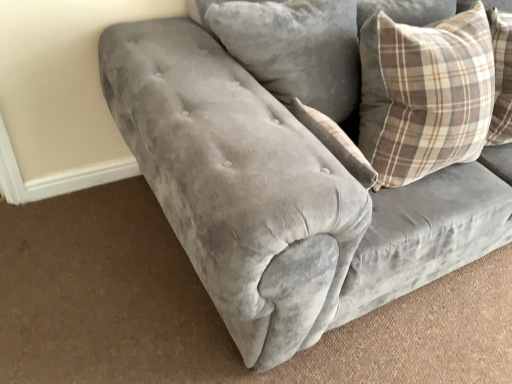
Image resolution: width=512 pixels, height=384 pixels. What do you see at coordinates (425, 94) in the screenshot?
I see `plaid fabric pillow at upper right, which appears as the second pillow when viewed from the left` at bounding box center [425, 94].

Measure the distance between plaid fabric pillow at upper right, which appears as the second pillow when viewed from the left, and camera.

They are 1.04 meters apart.

In order to click on plaid fabric pillow at upper right, which appears as the second pillow when viewed from the left in this screenshot , I will do `click(425, 94)`.

Locate an element on the screen. plaid fabric pillow at upper right, arranged as the 2th pillow when viewed from the right is located at coordinates pos(295,49).

The width and height of the screenshot is (512, 384). Describe the element at coordinates (295, 49) in the screenshot. I see `plaid fabric pillow at upper right, placed as the first pillow when sorted from left to right` at that location.

This screenshot has width=512, height=384. Find the location of `plaid fabric pillow at upper right, the 1th pillow from the right`. plaid fabric pillow at upper right, the 1th pillow from the right is located at coordinates (425, 94).

In the scene shown: Can you confirm if plaid fabric pillow at upper right, which appears as the second pillow when viewed from the left, is positioned to the right of plaid fabric pillow at upper right, placed as the first pillow when sorted from left to right?

Indeed, plaid fabric pillow at upper right, which appears as the second pillow when viewed from the left, is positioned on the right side of plaid fabric pillow at upper right, placed as the first pillow when sorted from left to right.

Is plaid fabric pillow at upper right, which appears as the second pillow when viewed from the left, in front of or behind plaid fabric pillow at upper right, arranged as the 2th pillow when viewed from the right, in the image?

In the image, plaid fabric pillow at upper right, which appears as the second pillow when viewed from the left, appears in front of plaid fabric pillow at upper right, arranged as the 2th pillow when viewed from the right.

Does point (389, 169) come farther from viewer compared to point (266, 32)?

Yes, it is.

From the image's perspective, does plaid fabric pillow at upper right, the 1th pillow from the right, appear lower than plaid fabric pillow at upper right, arranged as the 2th pillow when viewed from the right?

Yes, from the image's perspective, plaid fabric pillow at upper right, the 1th pillow from the right, is beneath plaid fabric pillow at upper right, arranged as the 2th pillow when viewed from the right.

From a real-world perspective, which is physically above, plaid fabric pillow at upper right, which appears as the second pillow when viewed from the left, or plaid fabric pillow at upper right, placed as the first pillow when sorted from left to right?

In real-world perspective, plaid fabric pillow at upper right, placed as the first pillow when sorted from left to right, is above.

Considering the relative sizes of plaid fabric pillow at upper right, the 1th pillow from the right, and plaid fabric pillow at upper right, arranged as the 2th pillow when viewed from the right, in the image provided, is plaid fabric pillow at upper right, the 1th pillow from the right, thinner than plaid fabric pillow at upper right, arranged as the 2th pillow when viewed from the right,?

Correct, the width of plaid fabric pillow at upper right, the 1th pillow from the right, is less than that of plaid fabric pillow at upper right, arranged as the 2th pillow when viewed from the right.

Considering the sizes of plaid fabric pillow at upper right, which appears as the second pillow when viewed from the left, and plaid fabric pillow at upper right, arranged as the 2th pillow when viewed from the right, in the image, is plaid fabric pillow at upper right, which appears as the second pillow when viewed from the left, taller or shorter than plaid fabric pillow at upper right, arranged as the 2th pillow when viewed from the right,?

In the image, plaid fabric pillow at upper right, which appears as the second pillow when viewed from the left, appears to be shorter than plaid fabric pillow at upper right, arranged as the 2th pillow when viewed from the right.

Who is bigger, plaid fabric pillow at upper right, the 1th pillow from the right, or plaid fabric pillow at upper right, arranged as the 2th pillow when viewed from the right?

plaid fabric pillow at upper right, arranged as the 2th pillow when viewed from the right.

Do you think plaid fabric pillow at upper right, which appears as the second pillow when viewed from the left, is within plaid fabric pillow at upper right, arranged as the 2th pillow when viewed from the right, or outside of it?

plaid fabric pillow at upper right, which appears as the second pillow when viewed from the left, is not enclosed by plaid fabric pillow at upper right, arranged as the 2th pillow when viewed from the right.

Consider the image. Would you say plaid fabric pillow at upper right, which appears as the second pillow when viewed from the left, is a long distance from plaid fabric pillow at upper right, arranged as the 2th pillow when viewed from the right?

No, plaid fabric pillow at upper right, which appears as the second pillow when viewed from the left, is in close proximity to plaid fabric pillow at upper right, arranged as the 2th pillow when viewed from the right.

Is plaid fabric pillow at upper right, which appears as the second pillow when viewed from the left, looking in the opposite direction of plaid fabric pillow at upper right, placed as the first pillow when sorted from left to right?

plaid fabric pillow at upper right, which appears as the second pillow when viewed from the left, is not turned away from plaid fabric pillow at upper right, placed as the first pillow when sorted from left to right.

Where is `pillow that is above the plaid fabric pillow at upper right, the 1th pillow from the right (from the image's perspective)`? The image size is (512, 384). pillow that is above the plaid fabric pillow at upper right, the 1th pillow from the right (from the image's perspective) is located at coordinates (295, 49).

Would you say plaid fabric pillow at upper right, arranged as the 2th pillow when viewed from the right, is to the left or to the right of plaid fabric pillow at upper right, which appears as the second pillow when viewed from the left, in the picture?

Based on their positions, plaid fabric pillow at upper right, arranged as the 2th pillow when viewed from the right, is located to the left of plaid fabric pillow at upper right, which appears as the second pillow when viewed from the left.

In the image, is plaid fabric pillow at upper right, placed as the first pillow when sorted from left to right, positioned in front of or behind plaid fabric pillow at upper right, which appears as the second pillow when viewed from the left?

plaid fabric pillow at upper right, placed as the first pillow when sorted from left to right, is positioned farther from the viewer than plaid fabric pillow at upper right, which appears as the second pillow when viewed from the left.

Is point (321, 21) closer or farther from the camera than point (407, 60)?

Point (321, 21) appears to be farther away from the viewer than point (407, 60).

From the image's perspective, which one is positioned higher, plaid fabric pillow at upper right, placed as the first pillow when sorted from left to right, or plaid fabric pillow at upper right, the 1th pillow from the right?

plaid fabric pillow at upper right, placed as the first pillow when sorted from left to right, is shown above in the image.

From a real-world perspective, is plaid fabric pillow at upper right, arranged as the 2th pillow when viewed from the right, physically below plaid fabric pillow at upper right, which appears as the second pillow when viewed from the left?

No.

Which of these two, plaid fabric pillow at upper right, arranged as the 2th pillow when viewed from the right, or plaid fabric pillow at upper right, which appears as the second pillow when viewed from the left, is thinner?

plaid fabric pillow at upper right, which appears as the second pillow when viewed from the left, is thinner.

Which of these two, plaid fabric pillow at upper right, placed as the first pillow when sorted from left to right, or plaid fabric pillow at upper right, which appears as the second pillow when viewed from the left, stands shorter?

plaid fabric pillow at upper right, which appears as the second pillow when viewed from the left, is shorter.

Is plaid fabric pillow at upper right, placed as the first pillow when sorted from left to right, smaller than plaid fabric pillow at upper right, which appears as the second pillow when viewed from the left?

Incorrect, plaid fabric pillow at upper right, placed as the first pillow when sorted from left to right, is not smaller in size than plaid fabric pillow at upper right, which appears as the second pillow when viewed from the left.

Could plaid fabric pillow at upper right, which appears as the second pillow when viewed from the left, be considered to be inside plaid fabric pillow at upper right, placed as the first pillow when sorted from left to right?

Actually, plaid fabric pillow at upper right, which appears as the second pillow when viewed from the left, is outside plaid fabric pillow at upper right, placed as the first pillow when sorted from left to right.

Would you say plaid fabric pillow at upper right, placed as the first pillow when sorted from left to right, is a long distance from plaid fabric pillow at upper right, which appears as the second pillow when viewed from the left?

No, plaid fabric pillow at upper right, placed as the first pillow when sorted from left to right, is not far away from plaid fabric pillow at upper right, which appears as the second pillow when viewed from the left.

Does plaid fabric pillow at upper right, placed as the first pillow when sorted from left to right, turn towards plaid fabric pillow at upper right, the 1th pillow from the right?

Yes, plaid fabric pillow at upper right, placed as the first pillow when sorted from left to right, is facing plaid fabric pillow at upper right, the 1th pillow from the right.

How far apart are plaid fabric pillow at upper right, arranged as the 2th pillow when viewed from the right, and plaid fabric pillow at upper right, which appears as the second pillow when viewed from the left?

plaid fabric pillow at upper right, arranged as the 2th pillow when viewed from the right, and plaid fabric pillow at upper right, which appears as the second pillow when viewed from the left, are 7.93 inches apart.

Find the location of a particular element. Image resolution: width=512 pixels, height=384 pixels. pillow above the plaid fabric pillow at upper right, which appears as the second pillow when viewed from the left (from the image's perspective) is located at coordinates [x=295, y=49].

The image size is (512, 384). Find the location of `pillow below the plaid fabric pillow at upper right, placed as the first pillow when sorted from left to right (from the image's perspective)`. pillow below the plaid fabric pillow at upper right, placed as the first pillow when sorted from left to right (from the image's perspective) is located at coordinates (425, 94).

Image resolution: width=512 pixels, height=384 pixels. Identify the location of pillow on the left of plaid fabric pillow at upper right, which appears as the second pillow when viewed from the left. (295, 49).